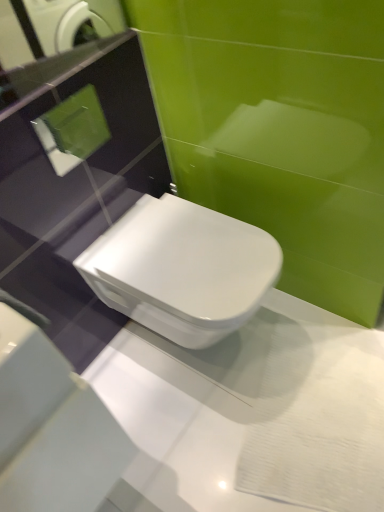
Question: Is glossy glass mirror at upper left aimed at white glossy toilet at center?

Choices:
 (A) no
 (B) yes

Answer: (A)

Question: Is the depth of glossy glass mirror at upper left less than that of white glossy toilet at center?

Choices:
 (A) yes
 (B) no

Answer: (A)

Question: Are glossy glass mirror at upper left and white glossy toilet at center making contact?

Choices:
 (A) no
 (B) yes

Answer: (A)

Question: Is white glossy toilet at center inside glossy glass mirror at upper left?

Choices:
 (A) no
 (B) yes

Answer: (A)

Question: Is glossy glass mirror at upper left positioned beyond the bounds of white glossy toilet at center?

Choices:
 (A) yes
 (B) no

Answer: (A)

Question: Does glossy glass mirror at upper left have a smaller size compared to white glossy toilet at center?

Choices:
 (A) yes
 (B) no

Answer: (A)

Question: Considering the relative sizes of white glossy toilet at center and glossy glass mirror at upper left in the image provided, is white glossy toilet at center bigger than glossy glass mirror at upper left?

Choices:
 (A) no
 (B) yes

Answer: (B)

Question: Is white glossy toilet at center facing towards glossy glass mirror at upper left?

Choices:
 (A) yes
 (B) no

Answer: (B)

Question: From a real-world perspective, is white glossy toilet at center positioned under glossy glass mirror at upper left based on gravity?

Choices:
 (A) no
 (B) yes

Answer: (B)

Question: Does white glossy toilet at center have a greater height compared to glossy glass mirror at upper left?

Choices:
 (A) no
 (B) yes

Answer: (B)

Question: Is white glossy toilet at center with glossy glass mirror at upper left?

Choices:
 (A) no
 (B) yes

Answer: (A)

Question: Is glossy glass mirror at upper left surrounded by white glossy toilet at center?

Choices:
 (A) yes
 (B) no

Answer: (B)

Question: In the image, is white glossy toilet at center on the left side or the right side of glossy glass mirror at upper left?

Choices:
 (A) left
 (B) right

Answer: (B)